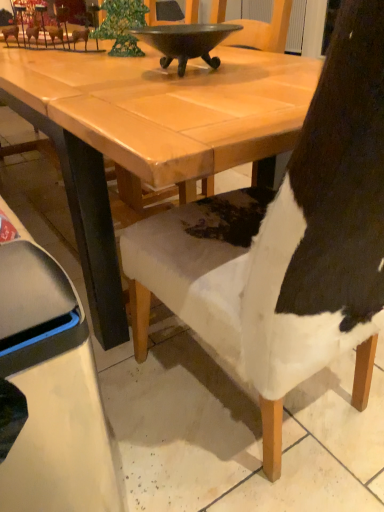
Identify the location of free location in front of shiny dark metal bowl at upper center. (184, 91).